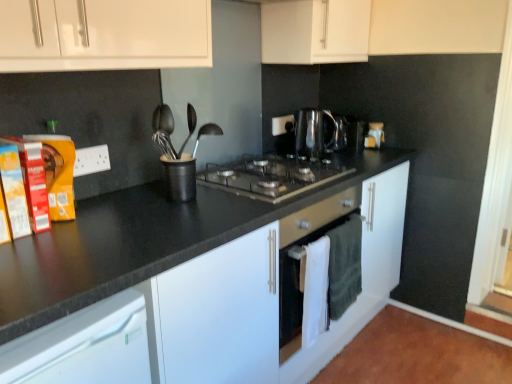
Image resolution: width=512 pixels, height=384 pixels. Find the location of `vacant space in front of black matte utensil holder at center`. vacant space in front of black matte utensil holder at center is located at coordinates (164, 214).